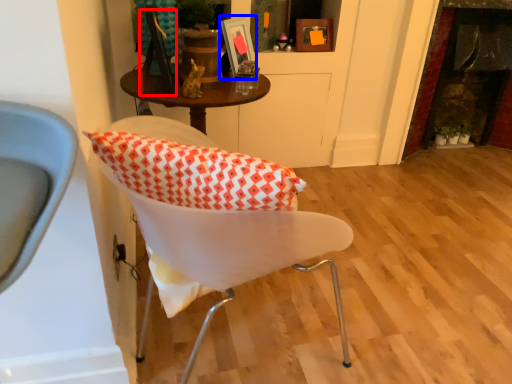
Question: Which point is further to the camera, picture frame (highlighted by a red box) or picture frame (highlighted by a blue box)?

Choices:
 (A) picture frame
 (B) picture frame

Answer: (B)